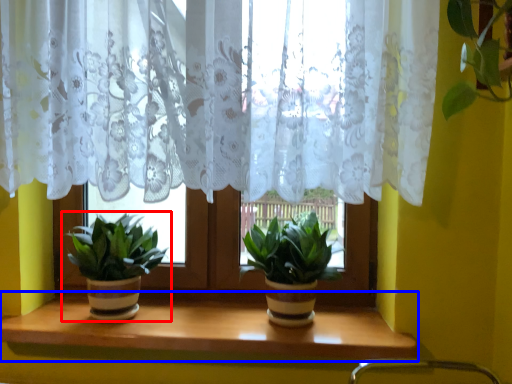
Question: Among these objects, which one is nearest to the camera, houseplant (highlighted by a red box) or window sill (highlighted by a blue box)?

Choices:
 (A) houseplant
 (B) window sill

Answer: (B)